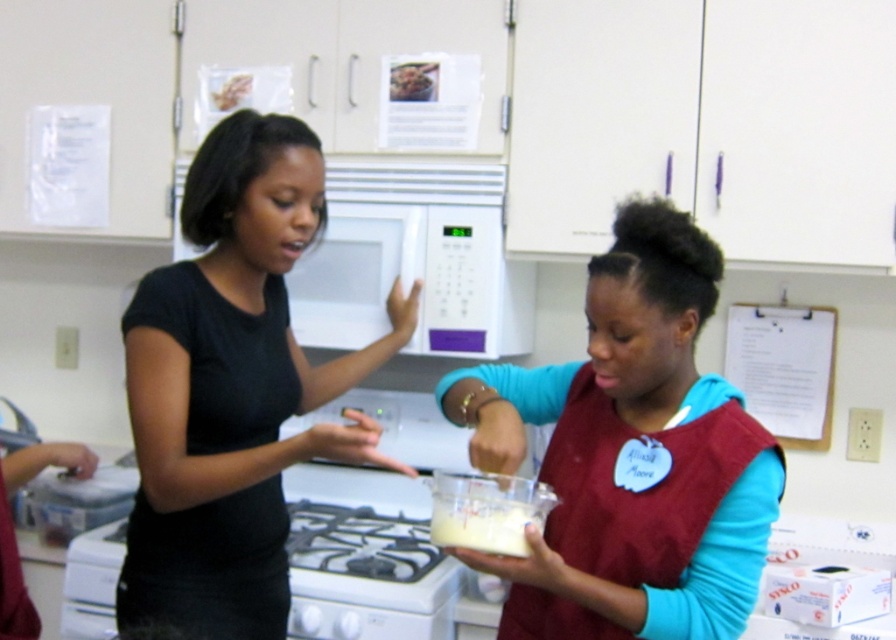
Is the position of black matte shirt at center more distant than that of white glossy stove at lower center?

No, it is in front of white glossy stove at lower center.

Measure the distance between black matte shirt at center and camera.

The distance of black matte shirt at center from camera is 4.52 feet.

The width and height of the screenshot is (896, 640). What do you see at coordinates (231, 388) in the screenshot? I see `black matte shirt at center` at bounding box center [231, 388].

Identify the location of black matte shirt at center. (231, 388).

Is white glossy stove at lower center wider than brown crumbly cake at upper center?

Indeed, white glossy stove at lower center has a greater width compared to brown crumbly cake at upper center.

Between point (355, 528) and point (416, 65), which one is positioned in front?

Point (416, 65) is more forward.

The height and width of the screenshot is (640, 896). Identify the location of white glossy stove at lower center. (366, 576).

Does maroon fabric apron at center appear over white glossy stove at lower center?

Indeed, maroon fabric apron at center is positioned over white glossy stove at lower center.

Is the position of maroon fabric apron at center less distant than that of white glossy stove at lower center?

Yes, maroon fabric apron at center is in front of white glossy stove at lower center.

Between point (705, 440) and point (89, 534), which one is positioned behind?

The point (89, 534) is more distant.

At what (x,y) coordinates should I click in order to perform the action: click on maroon fabric apron at center. Please return your answer as a coordinate pair (x, y). The width and height of the screenshot is (896, 640). Looking at the image, I should click on (631, 454).